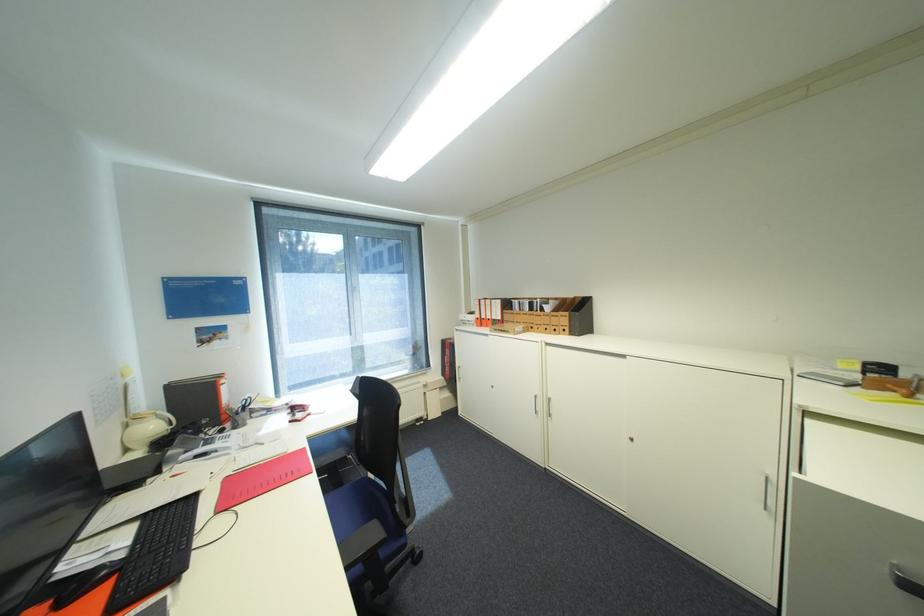
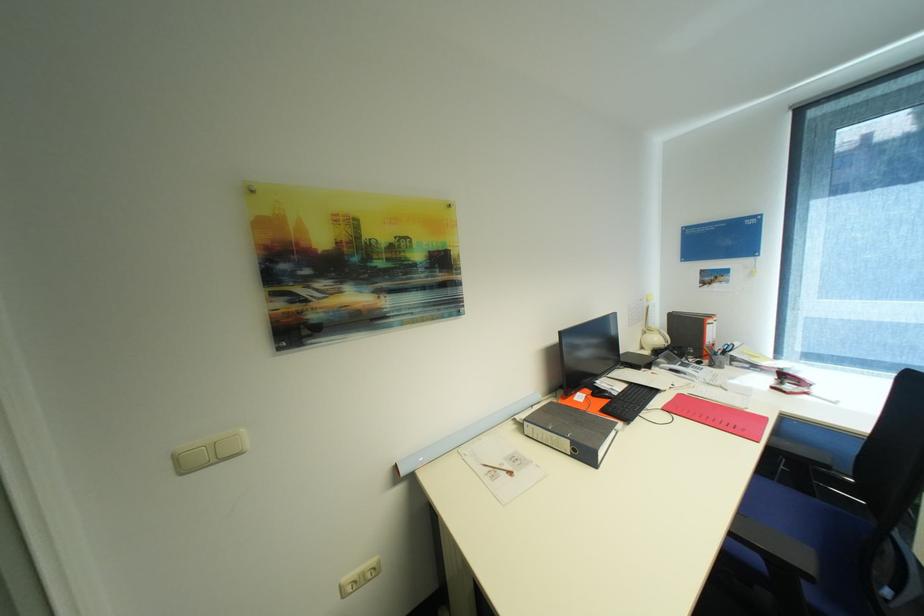
Locate, in the second image, the point that corresponds to point 137,543 in the first image.

(627, 391)